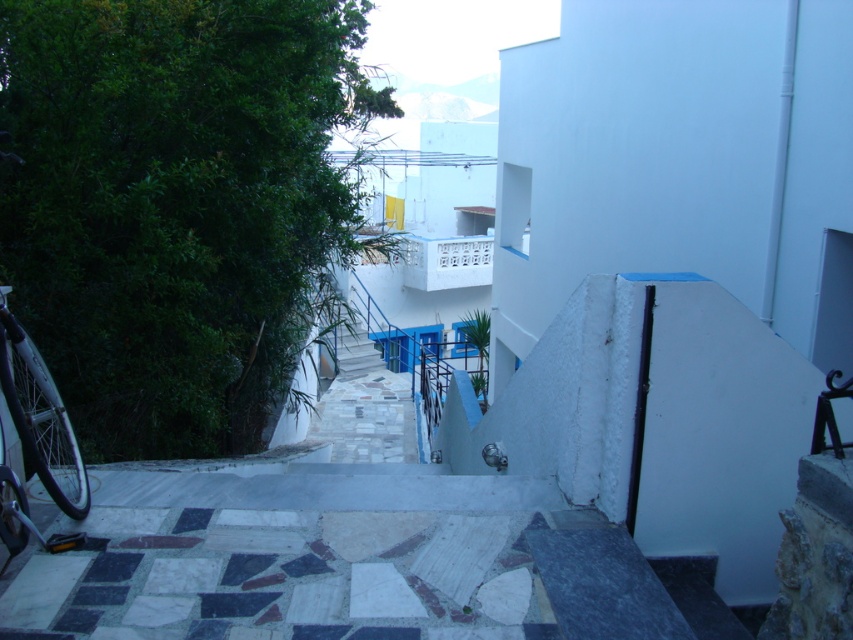
Question: Considering the relative positions of silver metallic bicycle at left and white marble stairs at center in the image provided, where is silver metallic bicycle at left located with respect to white marble stairs at center?

Choices:
 (A) right
 (B) left

Answer: (B)

Question: Which object is farther from the camera taking this photo?

Choices:
 (A) silver metallic bicycle at left
 (B) white marble stairs at center

Answer: (B)

Question: Does silver metallic bicycle at left appear on the left side of white marble stairs at center?

Choices:
 (A) yes
 (B) no

Answer: (A)

Question: Which point is farther from the camera taking this photo?

Choices:
 (A) (61, 401)
 (B) (349, 461)

Answer: (B)

Question: Does silver metallic bicycle at left appear under white marble stairs at center?

Choices:
 (A) yes
 (B) no

Answer: (B)